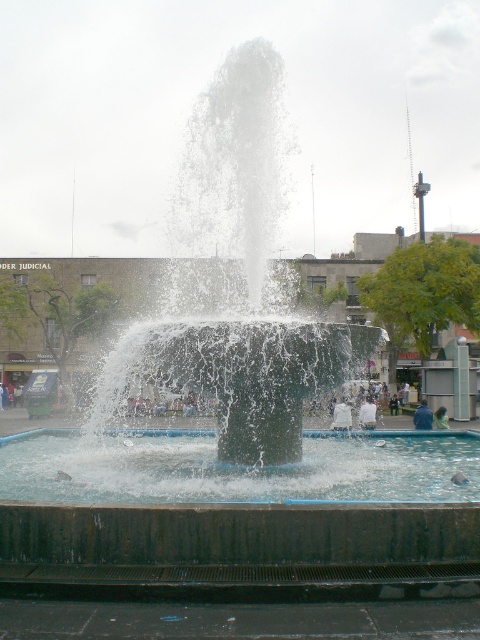
You are standing at the edge of the fountain and notice the clear water at center and the light brown hair at center. Which object is higher in height?

The clear water at center is much taller than the light brown hair at center.

You are standing at the edge of the fountain pool and see the blue denim jacket at center. If you walk straight towards the jacket, will you step into the pool?

The blue denim jacket at center is located at point (422, 417). Since the jacket is at the center of the fountain, which is surrounded by a pool, walking straight towards it would require stepping into the pool.

You are standing at the edge of the pool and want to locate the clear water at center. Based on the coordinates provided, in which direction should you look relative to your position?

You should look towards the center of the pool, where the clear water at center is located at coordinates point (238, 467).